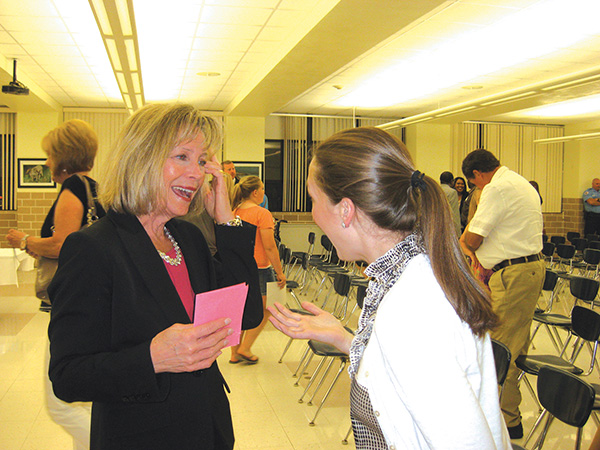
Find the location of a particular element. The height and width of the screenshot is (450, 600). tile flooring is located at coordinates (261, 429).